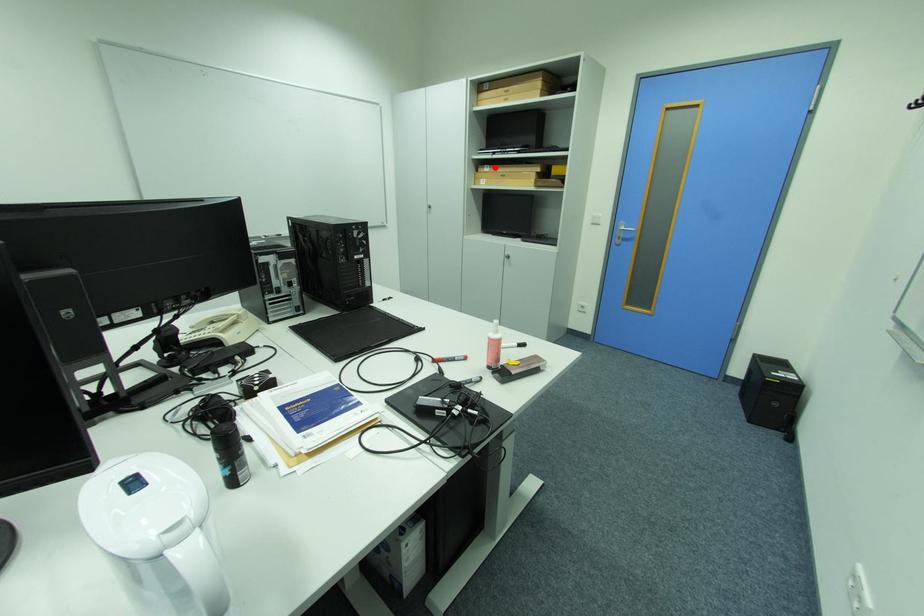
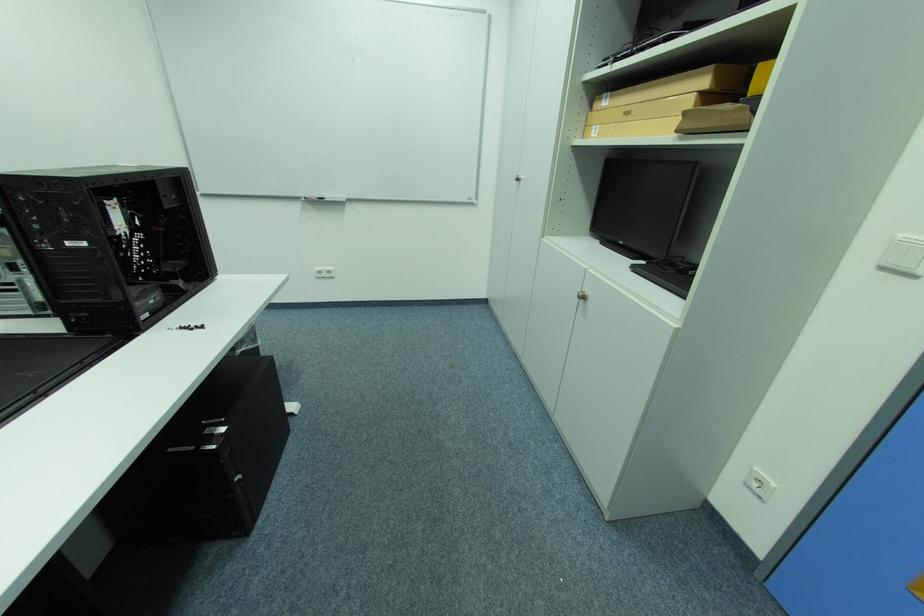
Locate, in the second image, the point that corresponds to the highlighted location in the first image.

(614, 98)